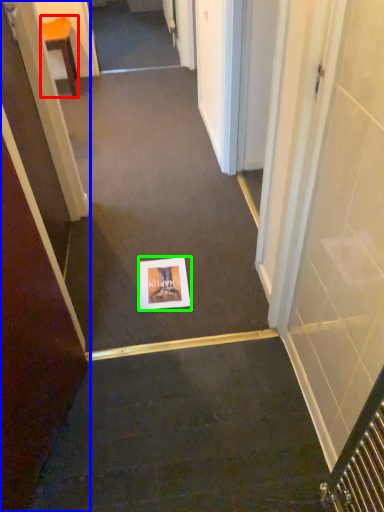
Question: Which object is positioned farthest from furniture (highlighted by a red box)? Select from door (highlighted by a blue box) and postcard (highlighted by a green box).

Choices:
 (A) door
 (B) postcard

Answer: (A)